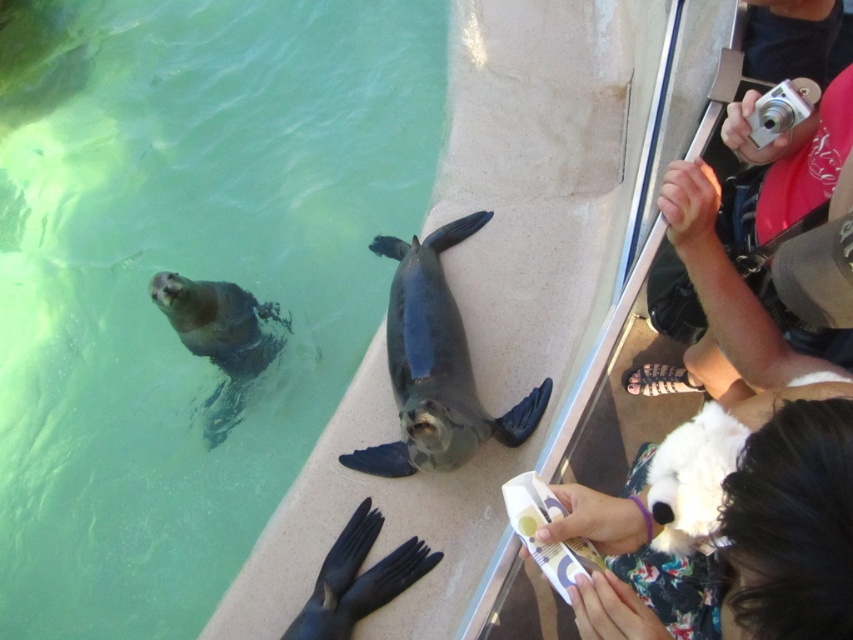
Who is lower down, green smooth water at upper left or black rubber fins at lower center?

Positioned lower is black rubber fins at lower center.

Can you confirm if green smooth water at upper left is positioned to the right of black rubber fins at lower center?

No, green smooth water at upper left is not to the right of black rubber fins at lower center.

The width and height of the screenshot is (853, 640). What are the coordinates of `green smooth water at upper left` in the screenshot? It's located at (184, 275).

Is white fluffy dog at lower right to the left of black rubber fins at lower center from the viewer's perspective?

In fact, white fluffy dog at lower right is to the right of black rubber fins at lower center.

Does white fluffy dog at lower right appear under black rubber fins at lower center?

Incorrect, white fluffy dog at lower right is not positioned below black rubber fins at lower center.

Is point (598, 544) farther from camera compared to point (399, 552)?

That is False.

Where is `white fluffy dog at lower right`? This screenshot has height=640, width=853. white fluffy dog at lower right is located at coordinates (732, 544).

Is white fluffy dog at lower right shorter than gray matte penguin at lower left?

Yes, white fluffy dog at lower right is shorter than gray matte penguin at lower left.

Between white fluffy dog at lower right and gray matte penguin at lower left, which one appears on the right side from the viewer's perspective?

From the viewer's perspective, white fluffy dog at lower right appears more on the right side.

Between point (705, 605) and point (189, 314), which one is positioned behind?

The point (189, 314) is behind.

Locate an element on the screen. Image resolution: width=853 pixels, height=640 pixels. white fluffy dog at lower right is located at coordinates (732, 544).